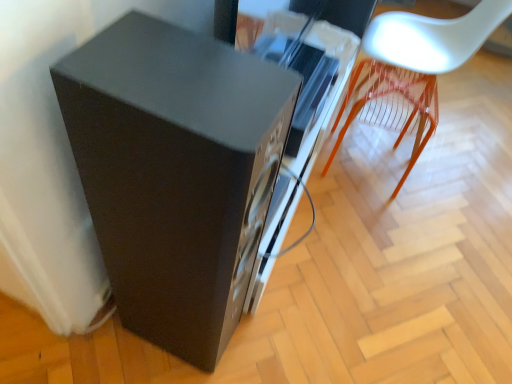
Question: From a real-world perspective, is white plastic chair at upper right above or below matte black speaker at lower left?

Choices:
 (A) below
 (B) above

Answer: (A)

Question: Considering the positions of point (408, 44) and point (220, 223), is point (408, 44) closer or farther from the camera than point (220, 223)?

Choices:
 (A) closer
 (B) farther

Answer: (B)

Question: Is white plastic chair at upper right bigger or smaller than matte black speaker at lower left?

Choices:
 (A) big
 (B) small

Answer: (A)

Question: In terms of height, does matte black speaker at lower left look taller or shorter compared to white plastic chair at upper right?

Choices:
 (A) short
 (B) tall

Answer: (B)

Question: In terms of width, does matte black speaker at lower left look wider or thinner when compared to white plastic chair at upper right?

Choices:
 (A) wide
 (B) thin

Answer: (B)

Question: In terms of size, does matte black speaker at lower left appear bigger or smaller than white plastic chair at upper right?

Choices:
 (A) big
 (B) small

Answer: (B)

Question: Does point (96, 233) appear closer or farther from the camera than point (391, 18)?

Choices:
 (A) closer
 (B) farther

Answer: (A)